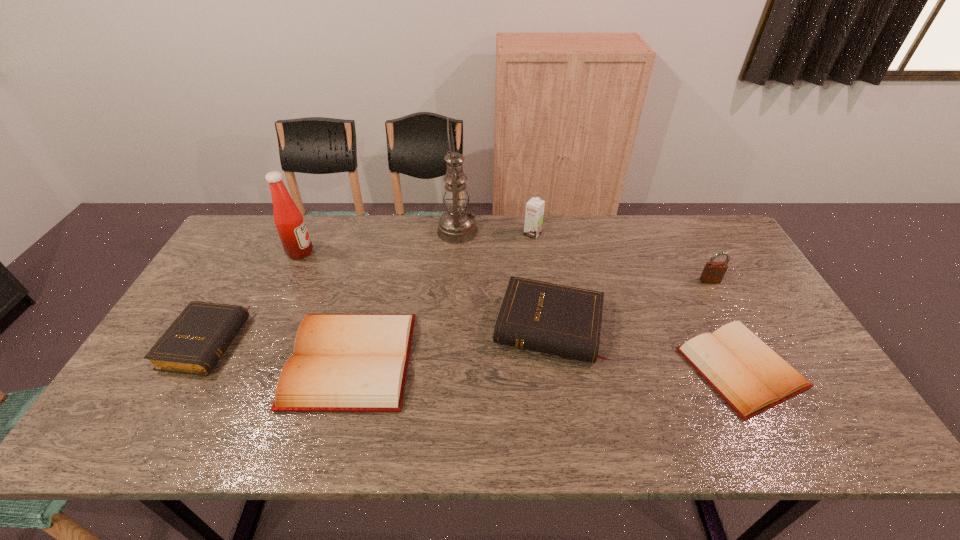
The width and height of the screenshot is (960, 540). What are the coordinates of `object located in the near right corner section of the desktop` in the screenshot? It's located at (751, 377).

Find the location of a particular element. The image size is (960, 540). vacant space at the far edge of the desktop is located at coordinates (613, 236).

This screenshot has width=960, height=540. In the image, there is a desktop. In order to click on vacant space at the near edge in this screenshot , I will do `click(364, 416)`.

The image size is (960, 540). Find the location of `free space at the right edge`. free space at the right edge is located at coordinates (734, 263).

In the image, there is a desktop. Find the location of `free space at the far right corner`. free space at the far right corner is located at coordinates (704, 218).

This screenshot has height=540, width=960. I want to click on free space at the near right corner of the desktop, so click(843, 422).

What are the coordinates of `unoccupied area between the seventh object from right to left and the sixth object from right to left` in the screenshot? It's located at (x=325, y=306).

Locate an element on the screen. The height and width of the screenshot is (540, 960). free spot between the condiment and the third Bible from right to left is located at coordinates (325, 306).

The image size is (960, 540). What are the coordinates of `free space between the fourth farthest object and the chocolate milk` in the screenshot? It's located at (621, 258).

Find the location of a particular element. free point between the bigger red Bible and the leftmost Bible is located at coordinates (278, 352).